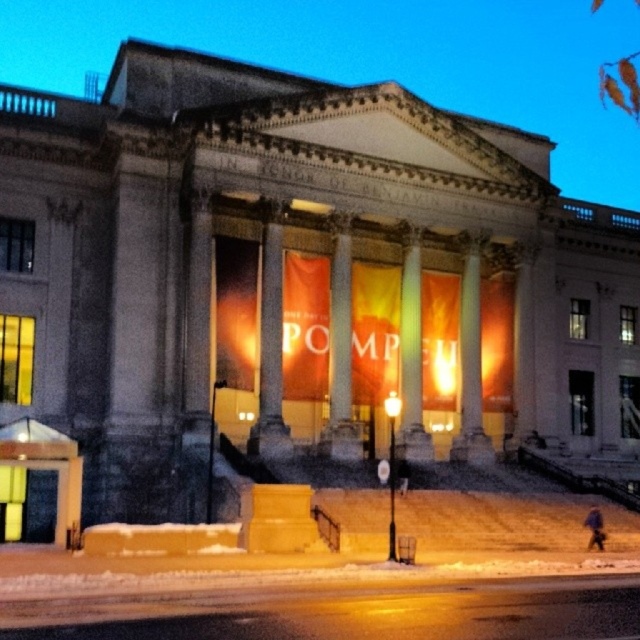
Where is `matte stone columns at center`? matte stone columns at center is located at coordinates (378, 60).

Who is shorter, matte stone columns at center or white marble column at center?

With less height is white marble column at center.

Identify the location of matte stone columns at center. Image resolution: width=640 pixels, height=640 pixels. (378, 60).

You are a GUI agent. You are given a task and a screenshot of the screen. Output one action in this format:
    pyautogui.click(x=<x>, y=<y>)
    Task: Click on the matte stone columns at center
    The width and height of the screenshot is (640, 640).
    Given the screenshot: What is the action you would take?
    pyautogui.click(x=378, y=60)

Can you confirm if matte stone columns at center is taller than white marble pillar at center?

Indeed, matte stone columns at center has a greater height compared to white marble pillar at center.

Find the location of a particular element. This screenshot has width=640, height=640. matte stone columns at center is located at coordinates (378, 60).

Who is more distant from viewer, (44, 12) or (264, 273)?

Point (44, 12)

At what (x,y) coordinates should I click in order to perform the action: click on matte stone columns at center. Please return your answer as a coordinate pair (x, y). Looking at the image, I should click on (378, 60).

Does white marble pillar at center have a greater height compared to white marble column at center?

Incorrect, white marble pillar at center's height is not larger of white marble column at center's.

From the picture: Is white marble pillar at center smaller than white marble column at center?

Yes.

Is point (268, 273) positioned before point (480, 436)?

Yes, point (268, 273) is closer to viewer.

Where is `white marble pillar at center`? This screenshot has height=640, width=640. white marble pillar at center is located at coordinates (269, 352).